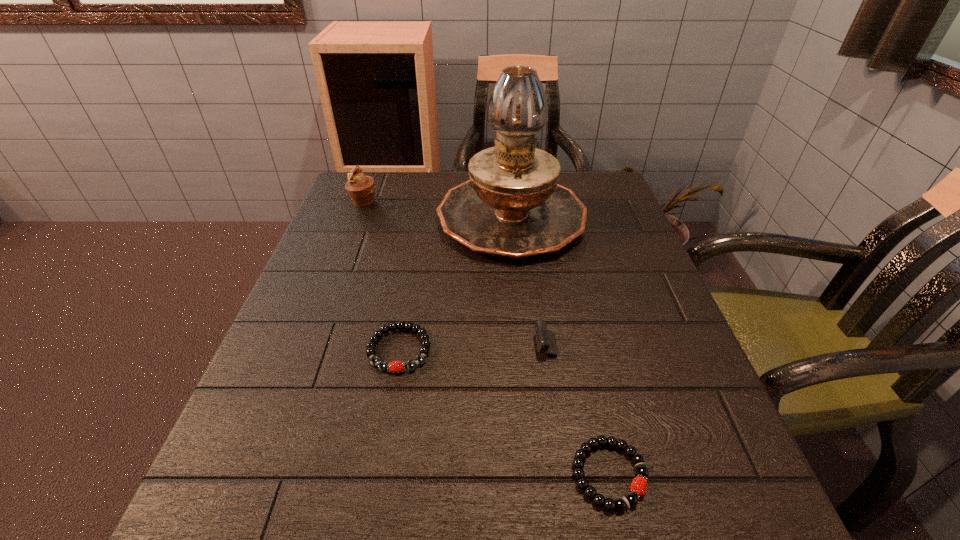
Choose which object is the fourth nearest neighbor to the left bracelet. Please provide its 2D coordinates. Your answer should be formatted as a tuple, i.e. [(x, y)], where the tuple contains the x and y coordinates of a point satisfying the conditions above.

[(361, 189)]

At what (x,y) coordinates should I click in order to perform the action: click on free space that satisfies the following two spatial constraints: 1. on the front side of the fourth shortest object; 2. on the left side of the oil lamp. Please return your answer as a coordinate pair (x, y). The width and height of the screenshot is (960, 540). Looking at the image, I should click on (358, 217).

This screenshot has height=540, width=960. Identify the location of free spot that satisfies the following two spatial constraints: 1. on the front-facing side of the third tallest object; 2. on the front side of the nearest object. (618, 474).

This screenshot has height=540, width=960. I want to click on free space that satisfies the following two spatial constraints: 1. on the front-facing side of the third shortest object; 2. on the front side of the farther bracelet, so click(588, 349).